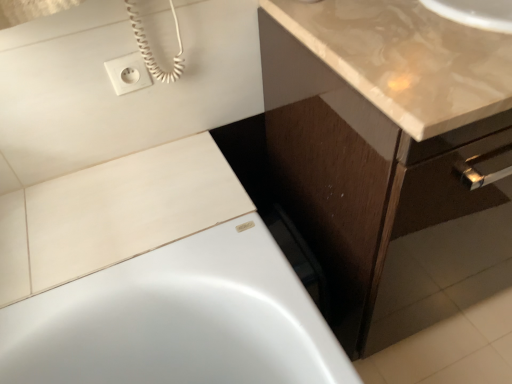
The width and height of the screenshot is (512, 384). Find the location of `white matte tile at upper left`. white matte tile at upper left is located at coordinates (128, 208).

This screenshot has height=384, width=512. What do you see at coordinates (128, 208) in the screenshot?
I see `white matte tile at upper left` at bounding box center [128, 208].

What do you see at coordinates (375, 140) in the screenshot? I see `brown wood cabinet at lower right` at bounding box center [375, 140].

Image resolution: width=512 pixels, height=384 pixels. I want to click on glossy beige countertop at upper right, so click(406, 59).

Is glossy beige countertop at upper right far away from brown wood cabinet at lower right?

They are positioned close to each other.

Where is `countertop in front of the brown wood cabinet at lower right`? The image size is (512, 384). countertop in front of the brown wood cabinet at lower right is located at coordinates (406, 59).

Consider the image. Is glossy beige countertop at upper right positioned beyond the bounds of brown wood cabinet at lower right?

Yes.

From a real-world perspective, which is physically above, glossy beige countertop at upper right or white matte tile at upper left?

glossy beige countertop at upper right.

Is glossy beige countertop at upper right in front of white matte tile at upper left?

Yes, the depth of glossy beige countertop at upper right is less than that of white matte tile at upper left.

Considering the sizes of objects glossy beige countertop at upper right and white matte tile at upper left in the image provided, who is bigger, glossy beige countertop at upper right or white matte tile at upper left?

Bigger between the two is glossy beige countertop at upper right.

The height and width of the screenshot is (384, 512). There is a white matte tile at upper left. Find the location of `countertop above it (from a real-world perspective)`. countertop above it (from a real-world perspective) is located at coordinates (406, 59).

Consider the image. Who is smaller, brown wood cabinet at lower right or glossy beige countertop at upper right?

With smaller size is glossy beige countertop at upper right.

Can you confirm if brown wood cabinet at lower right is positioned to the left of glossy beige countertop at upper right?

In fact, brown wood cabinet at lower right is to the right of glossy beige countertop at upper right.

You are a GUI agent. You are given a task and a screenshot of the screen. Output one action in this format:
    pyautogui.click(x=<x>, y=<y>)
    Task: Click on the countertop on the left of brown wood cabinet at lower right
    The image size is (512, 384).
    Given the screenshot: What is the action you would take?
    pyautogui.click(x=406, y=59)

Is brown wood cabinet at lower right facing towards glossy beige countertop at upper right?

No, brown wood cabinet at lower right does not turn towards glossy beige countertop at upper right.

Is white plastic outlet at upper left with glossy beige countertop at upper right?

No, white plastic outlet at upper left is not beside glossy beige countertop at upper right.

Looking at this image, from a real-world perspective, is white plastic outlet at upper left physically located above or below glossy beige countertop at upper right?

white plastic outlet at upper left is situated lower than glossy beige countertop at upper right in the real world.

Can you tell me how much white plastic outlet at upper left and glossy beige countertop at upper right differ in facing direction?

The facing directions of white plastic outlet at upper left and glossy beige countertop at upper right are 0.917 degrees apart.

From the image's perspective, which is above, white plastic outlet at upper left or glossy beige countertop at upper right?

glossy beige countertop at upper right is shown above in the image.

Who is bigger, white plastic outlet at upper left or white matte tile at upper left?

Bigger between the two is white matte tile at upper left.

Does white plastic outlet at upper left appear on the left side of white matte tile at upper left?

In fact, white plastic outlet at upper left is to the right of white matte tile at upper left.

Is white plastic outlet at upper left taller or shorter than white matte tile at upper left?

Clearly, white plastic outlet at upper left is taller compared to white matte tile at upper left.

Can you confirm if white matte tile at upper left is positioned to the left of brown wood cabinet at lower right?

Correct, you'll find white matte tile at upper left to the left of brown wood cabinet at lower right.

From the image's perspective, is white matte tile at upper left above brown wood cabinet at lower right?

Incorrect, from the image's perspective, white matte tile at upper left is lower than brown wood cabinet at lower right.

Looking at this image, how different are the orientations of white matte tile at upper left and brown wood cabinet at lower right in degrees?

0.824 degrees.

From the picture: From a real-world perspective, who is located higher, white matte tile at upper left or brown wood cabinet at lower right?

white matte tile at upper left, from a real-world perspective.

Considering the sizes of objects white matte tile at upper left and glossy beige countertop at upper right in the image provided, who is smaller, white matte tile at upper left or glossy beige countertop at upper right?

white matte tile at upper left is smaller.

From a real-world perspective, who is located higher, white matte tile at upper left or glossy beige countertop at upper right?

In real-world perspective, glossy beige countertop at upper right is above.

How many degrees apart are the facing directions of white matte tile at upper left and glossy beige countertop at upper right?

The angle between the facing direction of white matte tile at upper left and the facing direction of glossy beige countertop at upper right is 1.17 degrees.

Does point (160, 162) come farther from viewer compared to point (334, 57)?

Yes.

Identify the location of countertop that appears above the brown wood cabinet at lower right (from a real-world perspective). The width and height of the screenshot is (512, 384). click(x=406, y=59).

You are a GUI agent. You are given a task and a screenshot of the screen. Output one action in this format:
    pyautogui.click(x=<x>, y=<y>)
    Task: Click on the tile behind the glossy beige countertop at upper right
    The image size is (512, 384).
    Given the screenshot: What is the action you would take?
    pyautogui.click(x=128, y=208)

Based on their spatial positions, is white plastic outlet at upper left or brown wood cabinet at lower right further from glossy beige countertop at upper right?

white plastic outlet at upper left is positioned further to the anchor glossy beige countertop at upper right.

Estimate the real-world distances between objects in this image. Which object is further from white plastic outlet at upper left, white matte tile at upper left or brown wood cabinet at lower right?

brown wood cabinet at lower right lies further to white plastic outlet at upper left than the other object.

From the image, which object appears to be nearer to white plastic outlet at upper left, brown wood cabinet at lower right or glossy beige countertop at upper right?

glossy beige countertop at upper right lies closer to white plastic outlet at upper left than the other object.

Which object lies nearer to the anchor point white matte tile at upper left, white plastic outlet at upper left or glossy beige countertop at upper right?

Based on the image, white plastic outlet at upper left appears to be nearer to white matte tile at upper left.

In the scene shown: Estimate the real-world distances between objects in this image. Which object is closer to glossy beige countertop at upper right, brown wood cabinet at lower right or white plastic outlet at upper left?

brown wood cabinet at lower right is positioned closer to the anchor glossy beige countertop at upper right.

When comparing their distances from glossy beige countertop at upper right, does white matte tile at upper left or brown wood cabinet at lower right seem further?

Among the two, white matte tile at upper left is located further to glossy beige countertop at upper right.

From the image, which object appears to be farther from glossy beige countertop at upper right, white plastic outlet at upper left or white matte tile at upper left?

white plastic outlet at upper left is positioned further to the anchor glossy beige countertop at upper right.

Looking at the image, which one is located further to glossy beige countertop at upper right, white matte tile at upper left or white plastic outlet at upper left?

Based on the image, white plastic outlet at upper left appears to be further to glossy beige countertop at upper right.

Identify the location of countertop located between white plastic outlet at upper left and brown wood cabinet at lower right in the left-right direction. Image resolution: width=512 pixels, height=384 pixels. (406, 59).

The height and width of the screenshot is (384, 512). I want to click on electric outlet between white matte tile at upper left and brown wood cabinet at lower right from left to right, so click(x=128, y=73).

Where is `electric outlet between white matte tile at upper left and glossy beige countertop at upper right in the horizontal direction`? This screenshot has height=384, width=512. electric outlet between white matte tile at upper left and glossy beige countertop at upper right in the horizontal direction is located at coordinates (128, 73).

This screenshot has height=384, width=512. What are the coordinates of `countertop located between white matte tile at upper left and brown wood cabinet at lower right in the left-right direction` in the screenshot? It's located at (406, 59).